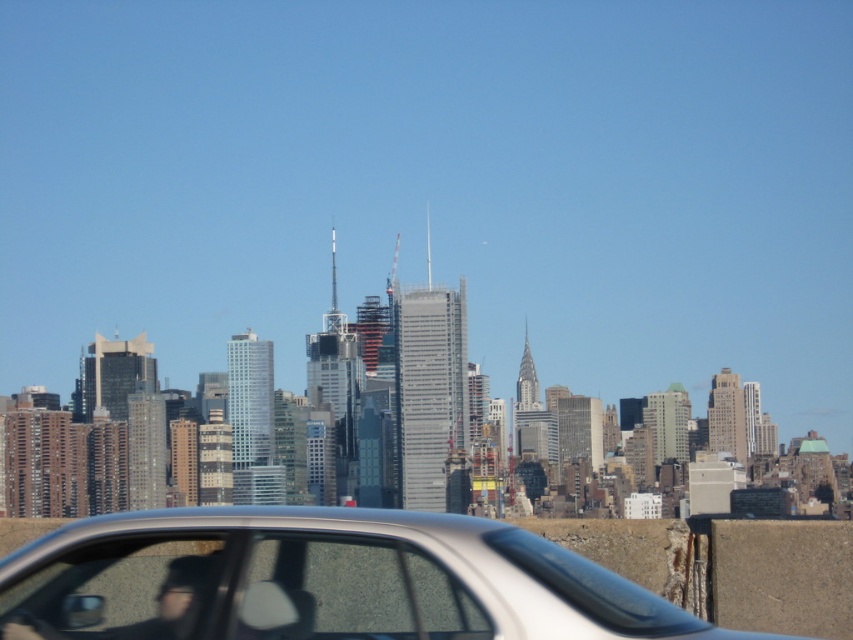
You are standing in the cityscape scene and want to place a small flag at the point that is closer to you. Which point should you choose between point (287, 614) and point (51, 620)?

You should choose point (287, 614) because it is closer to the viewer than point (51, 620).

You are a delivery drone operator. Your drone needs to fly through the space between the silver metallic car at center and the transparent glass car window at center. The drone has a wingspan of 0.8 meters. Can the drone safely pass through that space?

The silver metallic car at center is larger than the transparent glass car window at center, but the exact dimensions of the space between them are not provided. Without knowing the distance between the car and the window, it is impossible to determine if the drone can safely pass through.

You are a pedestrian standing at the crosswalk and see the silver metallic car at center and the transparent glass car window at lower left. Which object is higher from the ground?

The silver metallic car at center is higher than the transparent glass car window at lower left because it is positioned above it.